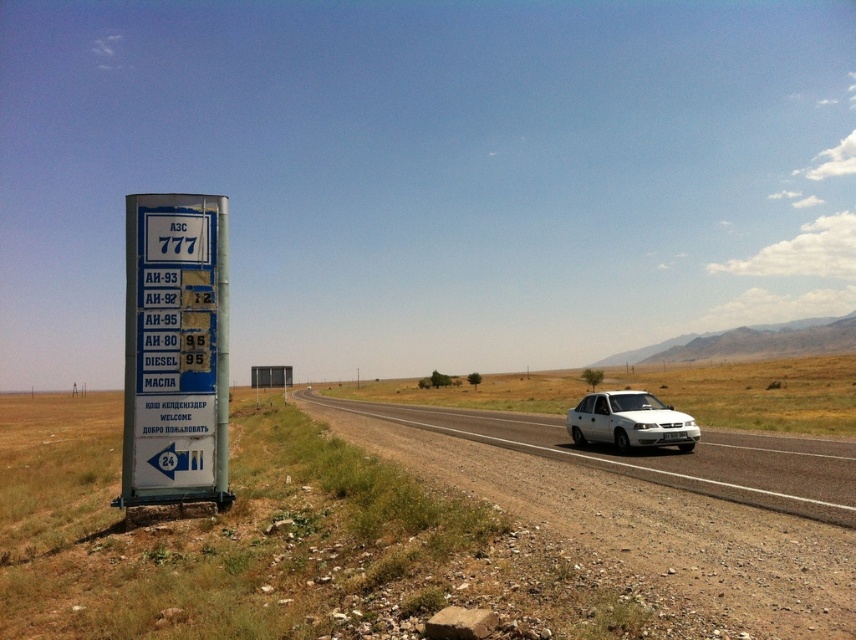
You are driving a delivery van that is 2.5 meters wide. You need to pass through the road where the white glossy car at center and the white matte sedan at right are located. Can your van fit between them if they are parked side by side?

The white glossy car at center is to the left of the white matte sedan at right, but the distance between them isn

You are a pedestrian standing at the side of the road near the fuel price sign. You see a white glossy car at center and a white matte sedan at right. Which vehicle is closer to the signboard?

The white glossy car at center is closer to the signboard because it is located below the white matte sedan at right, which places it nearer to the observer standing at the roadside.